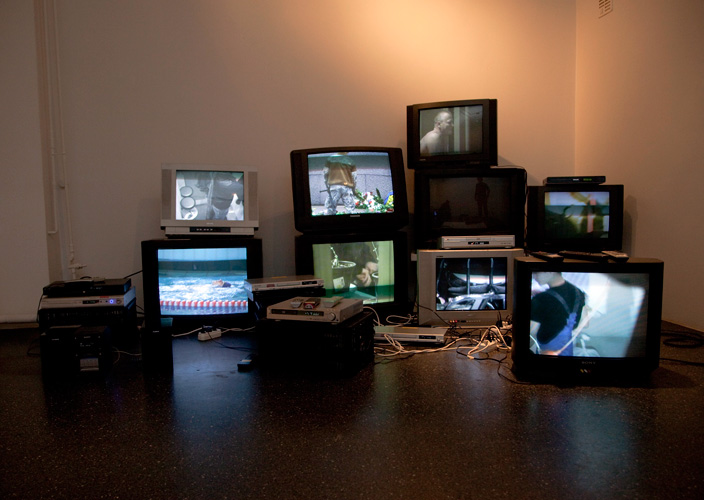
You are a GUI agent. You are given a task and a screenshot of the screen. Output one action in this format:
    pyautogui.click(x=<x>, y=<y>)
    Task: Click on the wall
    
    Given the screenshot: What is the action you would take?
    pyautogui.click(x=277, y=91)